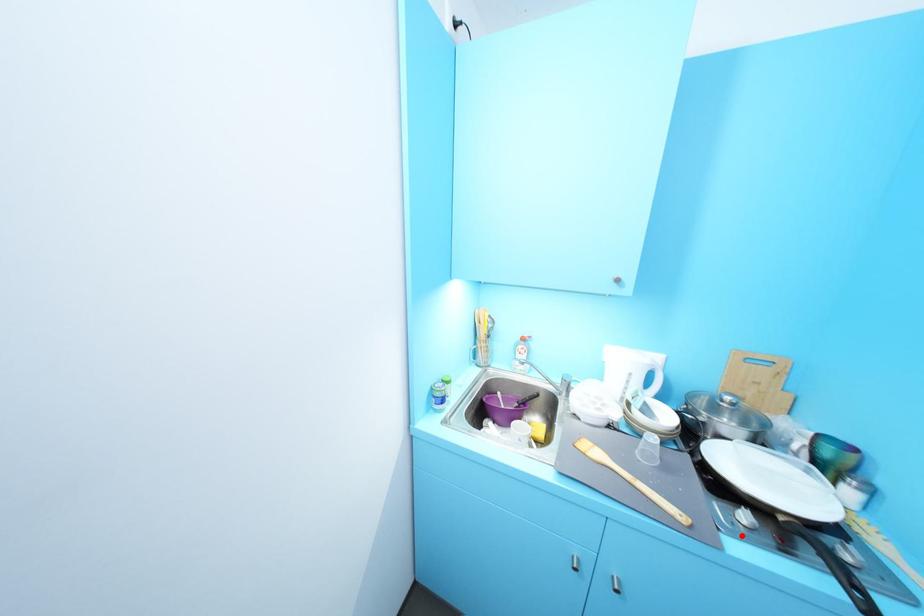
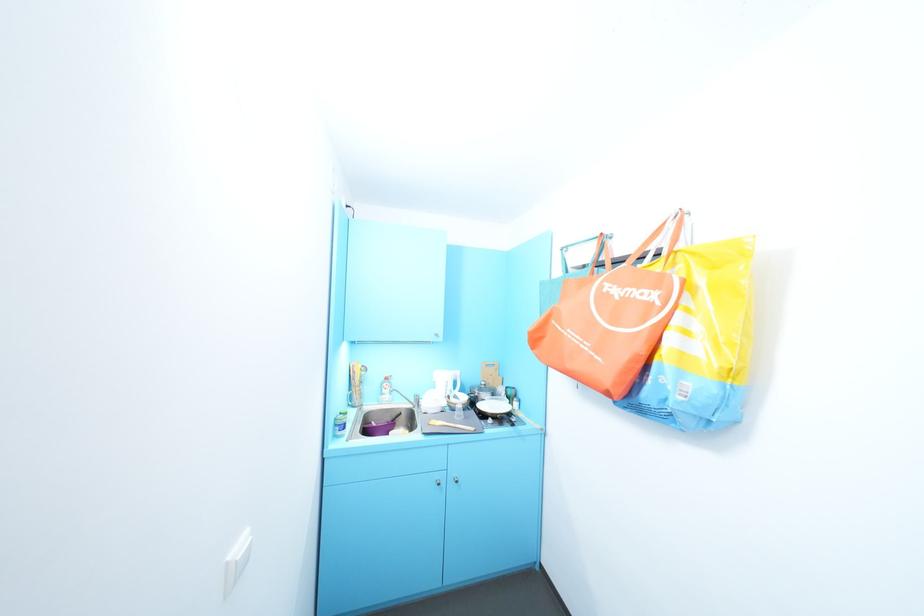
Where in the second image is the point corresponding to the highlighted location from the first image?

(494, 428)